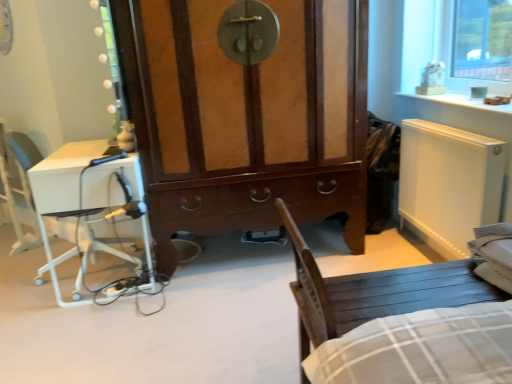
Locate an element on the screen. This screenshot has height=384, width=512. vacant space in front of white glossy desk at left is located at coordinates (93, 331).